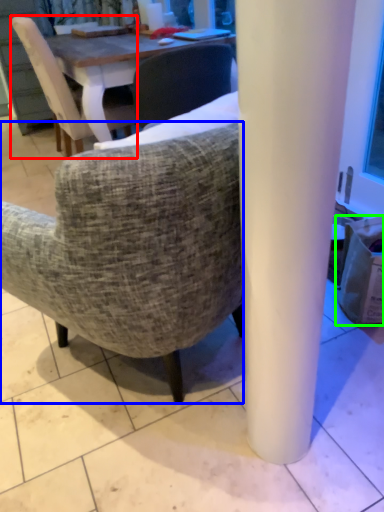
Question: Estimate the real-world distances between objects in this image. Which object is closer to chair (highlighted by a red box), chair (highlighted by a blue box) or trash bin/can (highlighted by a green box)?

Choices:
 (A) chair
 (B) trash bin/can

Answer: (A)